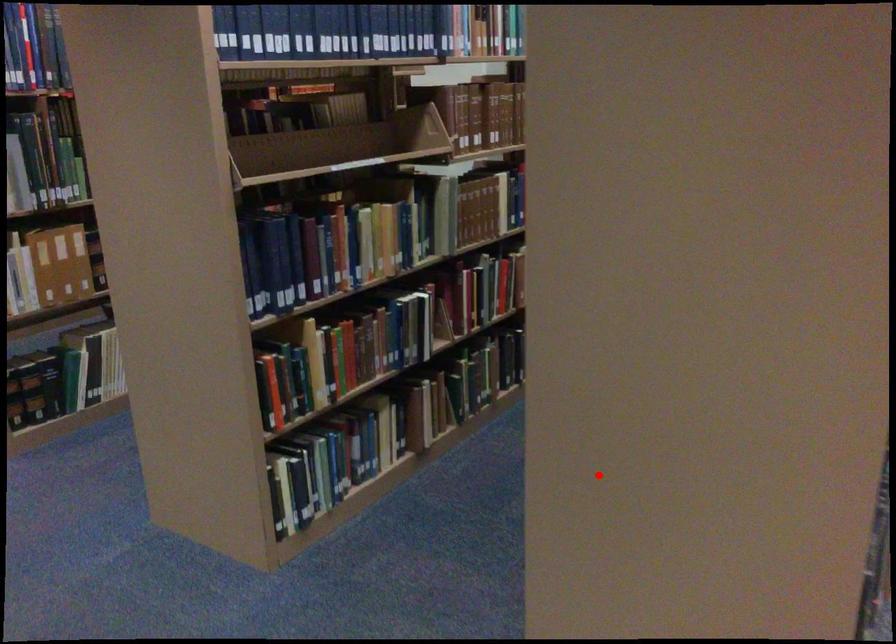
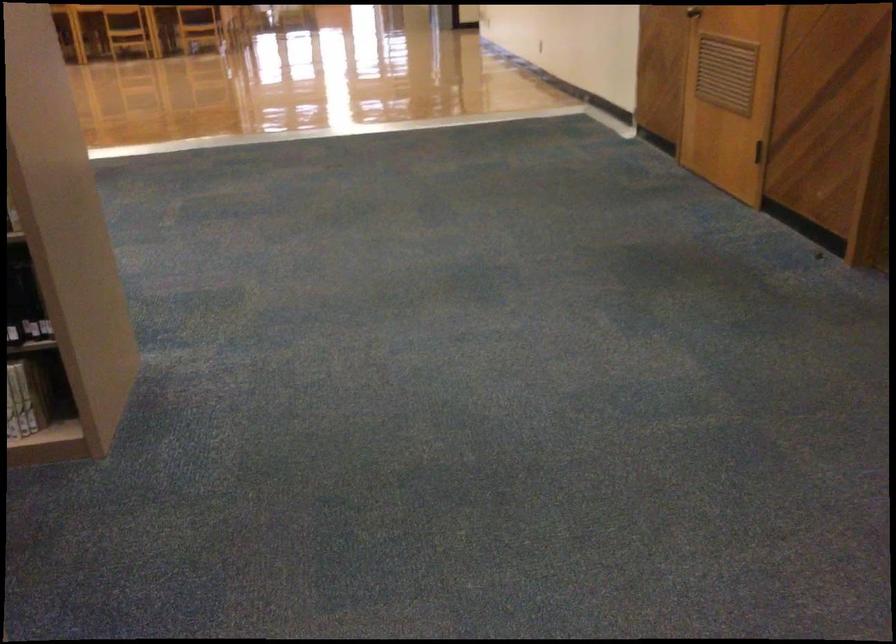
Where in the second image is the point corresponding to the highlighted location from the first image?

(23, 299)